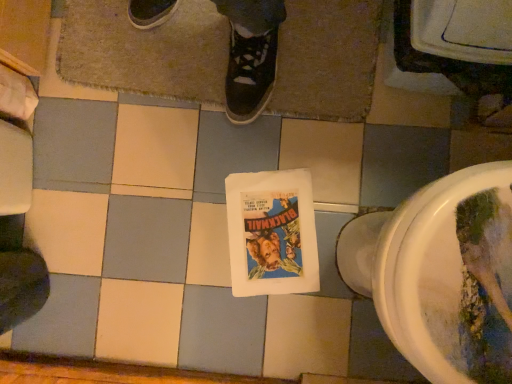
Locate an element on the screen. The image size is (512, 384). vacant region to the left of matte paper comic book at center is located at coordinates (166, 282).